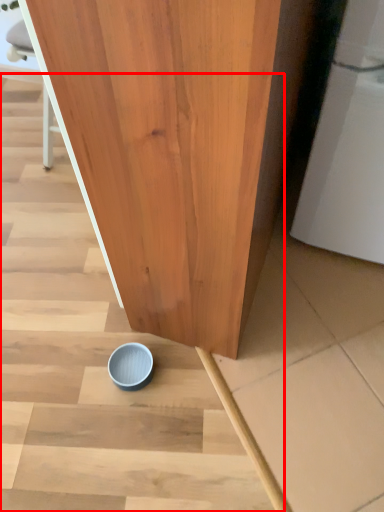
Question: From the image's perspective, where is stairwell (annotated by the red box) located relative to tableware?

Choices:
 (A) above
 (B) below

Answer: (A)